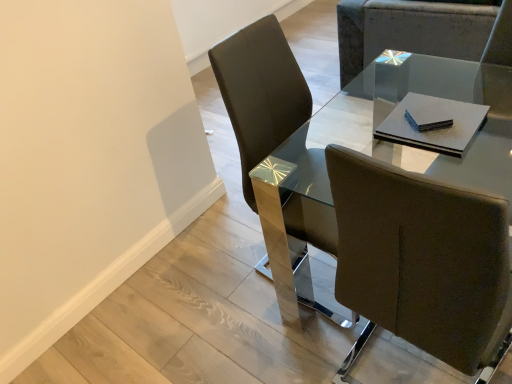
Locate an element on the screen. This screenshot has width=512, height=384. free space to the left of glass/metal table at center is located at coordinates coord(214,322).